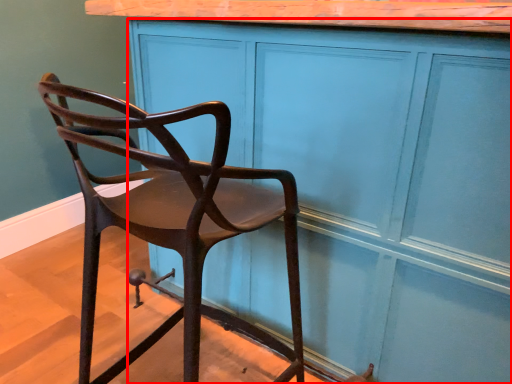
Question: From the image's perspective, where is cabinetry (annotated by the red box) located in relation to chair in the image?

Choices:
 (A) below
 (B) above

Answer: (B)